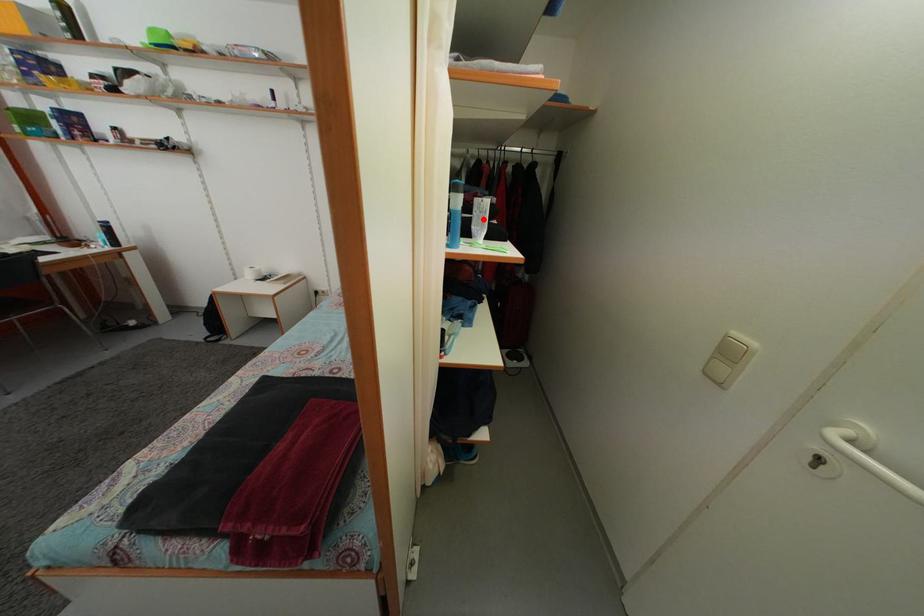
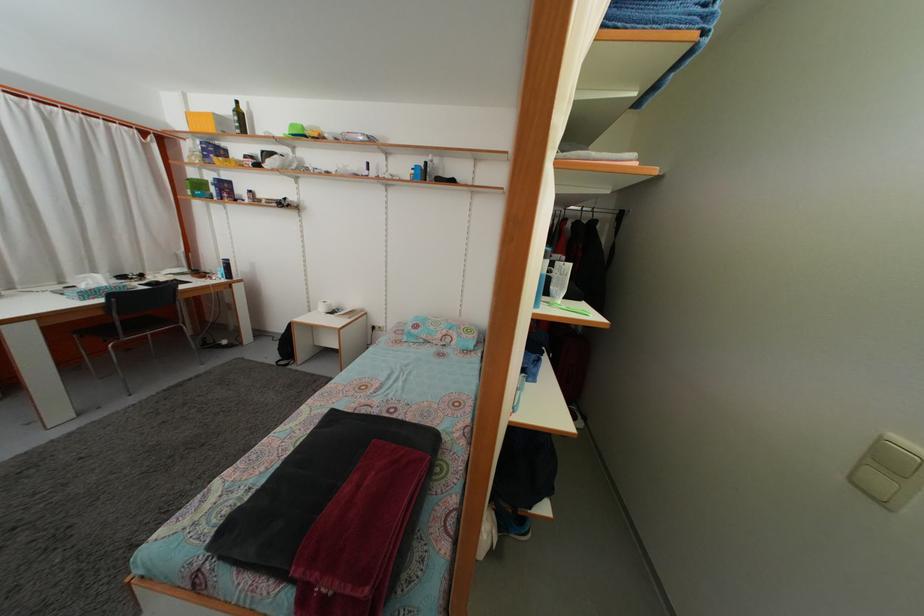
The point at the highlighted location is marked in the first image. Where is the corresponding point in the second image?

(564, 282)